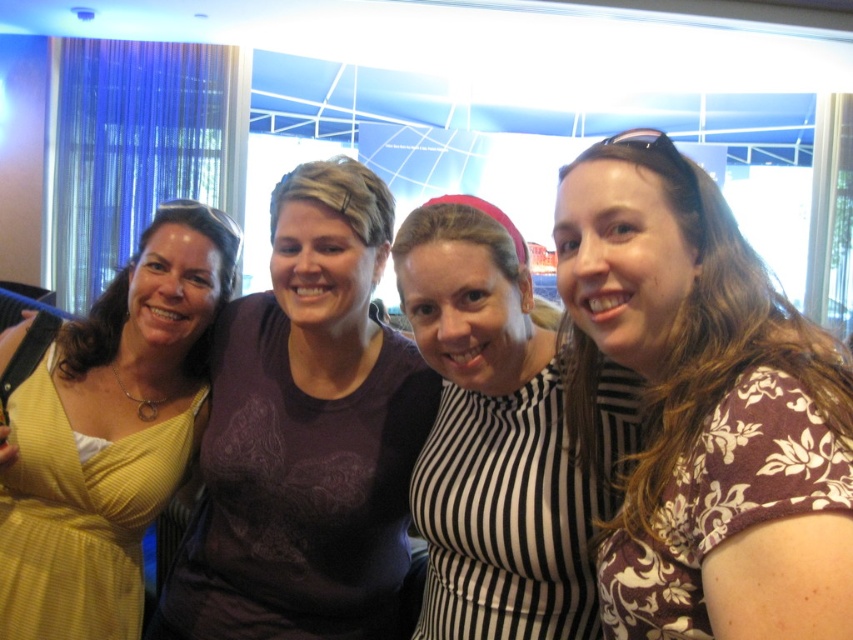
Question: Does floral print shirt at right have a lesser width compared to matte purple shirt at center?

Choices:
 (A) yes
 (B) no

Answer: (A)

Question: Which point is closer to the camera taking this photo?

Choices:
 (A) (648, 307)
 (B) (383, 248)
 (C) (136, 424)

Answer: (A)

Question: Can you confirm if matte purple shirt at center is bigger than black and white striped shirt at center?

Choices:
 (A) no
 (B) yes

Answer: (B)

Question: Is floral print shirt at right in front of matte purple shirt at center?

Choices:
 (A) no
 (B) yes

Answer: (B)

Question: Which of these objects is positioned farthest from the black and white striped shirt at center?

Choices:
 (A) floral print shirt at right
 (B) matte yellow dress at left

Answer: (B)

Question: Among these points, which one is farthest from the camera?

Choices:
 (A) (289, 518)
 (B) (502, 483)
 (C) (115, 288)

Answer: (C)